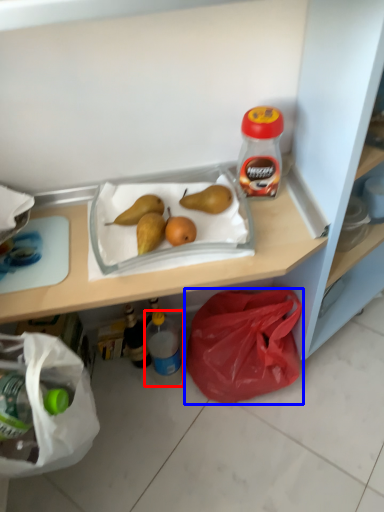
Question: Which point is closer to the camera, bottle (highlighted by a red box) or plastic bag (highlighted by a blue box)?

Choices:
 (A) bottle
 (B) plastic bag

Answer: (B)